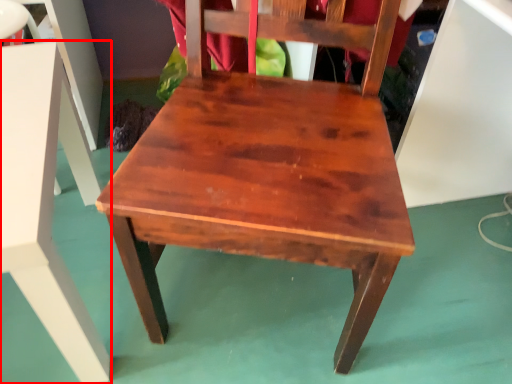
Question: In this image, where is table (annotated by the red box) located relative to chair?

Choices:
 (A) right
 (B) left

Answer: (B)